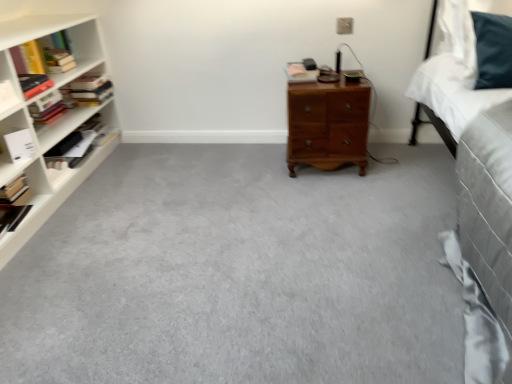
Question: Is yellow paperback book at left, which is the 3th book in left-to-right order, shorter than hardcover book at left, which is the second book from left to right?

Choices:
 (A) no
 (B) yes

Answer: (A)

Question: Is yellow paperback book at left, which is the sixth book from right to left, completely or partially outside of hardcover book at left, which is the second book from left to right?

Choices:
 (A) yes
 (B) no

Answer: (A)

Question: From the image's perspective, is yellow paperback book at left, which is the 3th book in left-to-right order, above hardcover book at left, which is the second book from left to right?

Choices:
 (A) yes
 (B) no

Answer: (A)

Question: Is yellow paperback book at left, which is the sixth book from right to left, positioned with its back to hardcover book at left, the seventh book from the right?

Choices:
 (A) no
 (B) yes

Answer: (A)

Question: Is yellow paperback book at left, which is the 3th book in left-to-right order, facing towards hardcover book at left, which is the second book from left to right?

Choices:
 (A) yes
 (B) no

Answer: (B)

Question: Is yellow paperback book at left, which is the sixth book from right to left, wider than hardcover book at left, which is the second book from left to right?

Choices:
 (A) yes
 (B) no

Answer: (A)

Question: Is white matte book at left, which appears as the seventh book when viewed from the left, behind yellow paperback book at left, which is the 3th book in left-to-right order?

Choices:
 (A) no
 (B) yes

Answer: (A)

Question: Can you confirm if white matte book at left, which appears as the seventh book when viewed from the left, is bigger than yellow paperback book at left, which is the 3th book in left-to-right order?

Choices:
 (A) yes
 (B) no

Answer: (B)

Question: Is yellow paperback book at left, which is the 3th book in left-to-right order, surrounded by white matte book at left, which appears as the seventh book when viewed from the left?

Choices:
 (A) yes
 (B) no

Answer: (B)

Question: Are white matte book at left, the 2th book in the right-to-left sequence, and yellow paperback book at left, which is the sixth book from right to left, beside each other?

Choices:
 (A) no
 (B) yes

Answer: (A)

Question: Is white matte book at left, the 2th book in the right-to-left sequence, turned away from yellow paperback book at left, which is the sixth book from right to left?

Choices:
 (A) yes
 (B) no

Answer: (B)

Question: From the image's perspective, is white matte book at left, which appears as the seventh book when viewed from the left, on yellow paperback book at left, which is the 3th book in left-to-right order?

Choices:
 (A) no
 (B) yes

Answer: (A)

Question: Does yellow paperback book at left, which is the 3th book in left-to-right order, appear on the right side of hardcover book at center, acting as the 8th book starting from the left?

Choices:
 (A) no
 (B) yes

Answer: (A)